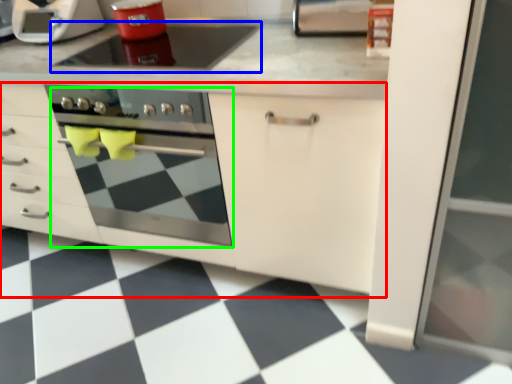
Question: Which object is the closest to the cabinetry (highlighted by a red box)? Choose among these: gas stove (highlighted by a blue box) or oven (highlighted by a green box).

Choices:
 (A) gas stove
 (B) oven

Answer: (A)